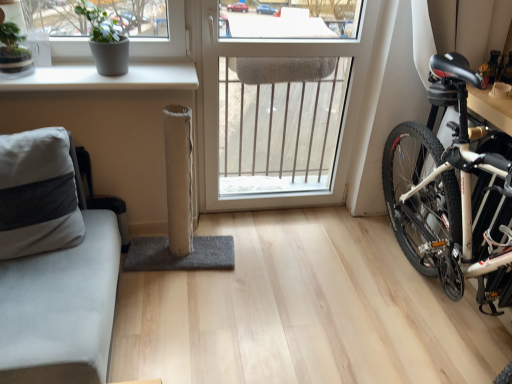
Locate an element on the screen. The width and height of the screenshot is (512, 384). free space to the right of gray matte pot at upper left is located at coordinates (153, 77).